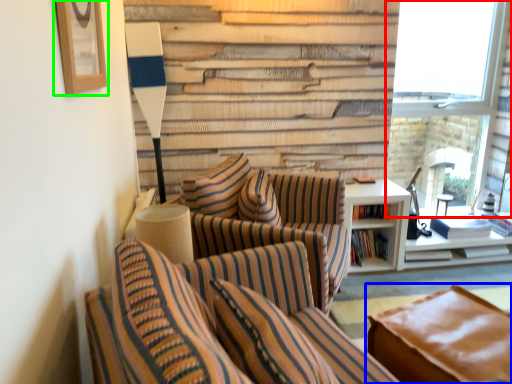
Question: Which object is positioned farthest from window (highlighted by a red box)? Select from studio couch (highlighted by a blue box) and picture frame (highlighted by a green box).

Choices:
 (A) studio couch
 (B) picture frame

Answer: (B)